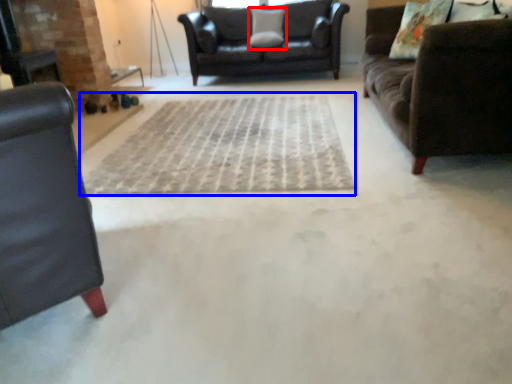
Question: Among these objects, which one is farthest to the camera, pillow (highlighted by a red box) or doormat (highlighted by a blue box)?

Choices:
 (A) pillow
 (B) doormat

Answer: (A)